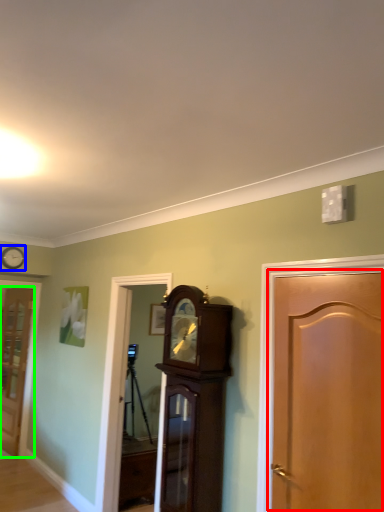
Question: Which object is positioned farthest from door (highlighted by a red box)? Select from clock (highlighted by a blue box) and door (highlighted by a green box).

Choices:
 (A) clock
 (B) door

Answer: (B)